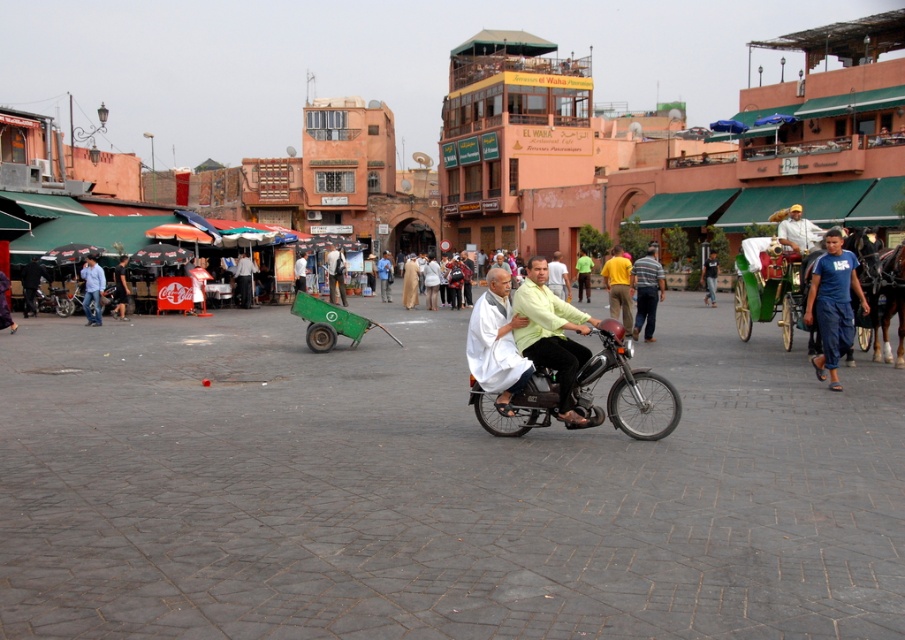
Can you confirm if light blue jeans at left is bigger than light brown leather jacket at center?

No.

How much distance is there between light blue jeans at left and light brown leather jacket at center?

light blue jeans at left and light brown leather jacket at center are 12.19 meters apart.

Between point (81, 273) and point (389, 292), which one is positioned behind?

Point (389, 292)

At what (x,y) coordinates should I click in order to perform the action: click on light blue jeans at left. Please return your answer as a coordinate pair (x, y). The image size is (905, 640). Looking at the image, I should click on (92, 289).

Is light brown shirt at center to the left of green fabric shirt at center from the viewer's perspective?

Yes, light brown shirt at center is to the left of green fabric shirt at center.

Can you confirm if light brown shirt at center is smaller than green fabric shirt at center?

Yes.

In order to click on light brown shirt at center in this screenshot , I will do `click(646, 291)`.

Between light green fabric shirt at center and green fabric shirt at center, which one is positioned lower?

light green fabric shirt at center is lower down.

Between point (538, 353) and point (582, 252), which one is positioned behind?

The point (582, 252) is behind.

Is point (596, 323) more distant than point (582, 256)?

No, (596, 323) is in front of (582, 256).

Image resolution: width=905 pixels, height=640 pixels. I want to click on light green fabric shirt at center, so click(x=551, y=336).